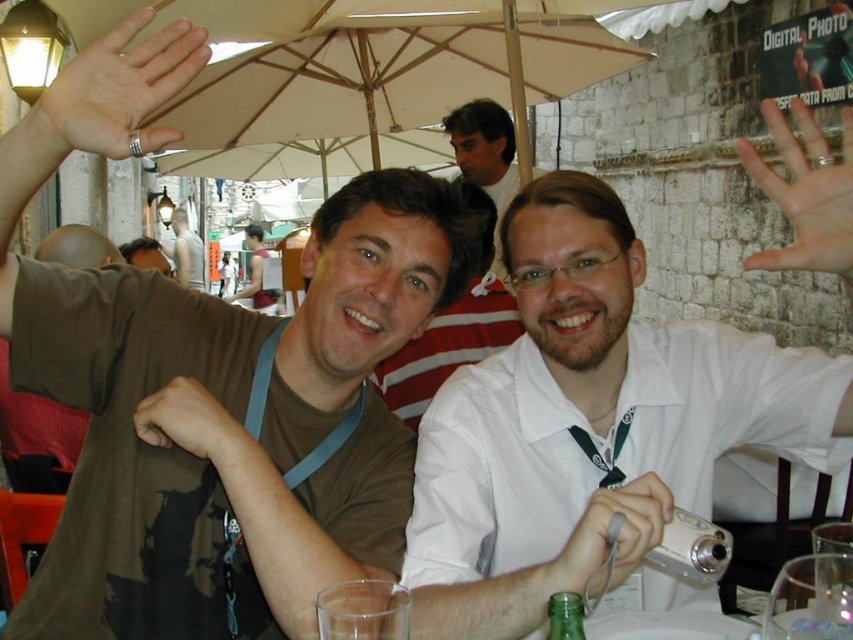
Based on the photo, can you confirm if beige fabric umbrella at upper center is shorter than light skin flesh at upper right?

Yes, beige fabric umbrella at upper center is shorter than light skin flesh at upper right.

What do you see at coordinates (364, 65) in the screenshot? I see `beige fabric umbrella at upper center` at bounding box center [364, 65].

Does point (212, 29) come farther from viewer compared to point (824, 220)?

Yes, point (212, 29) is farther from viewer.

The height and width of the screenshot is (640, 853). Identify the location of beige fabric umbrella at upper center. (364, 65).

Does silver metallic ring at upper left have a lesser width compared to brown leather wristband at lower left?

In fact, silver metallic ring at upper left might be wider than brown leather wristband at lower left.

Between silver metallic ring at upper left and brown leather wristband at lower left, which one is positioned higher?

silver metallic ring at upper left is higher up.

Between point (149, 68) and point (154, 406), which one is positioned in front?

Positioned in front is point (154, 406).

Locate an element on the screen. This screenshot has height=640, width=853. silver metallic ring at upper left is located at coordinates (120, 84).

Is white glossy shirt at center to the right of matte white shirt at center from the viewer's perspective?

In fact, white glossy shirt at center is to the left of matte white shirt at center.

Can you confirm if white glossy shirt at center is positioned to the left of matte white shirt at center?

Correct, you'll find white glossy shirt at center to the left of matte white shirt at center.

What do you see at coordinates (587, 420) in the screenshot? Image resolution: width=853 pixels, height=640 pixels. I see `white glossy shirt at center` at bounding box center [587, 420].

I want to click on white glossy shirt at center, so click(587, 420).